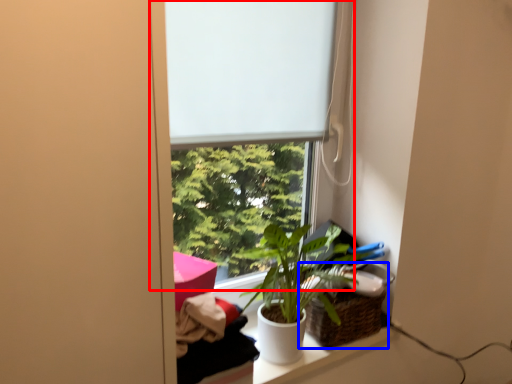
Question: Which object appears closest to the camera in this image, window (highlighted by a red box) or basket (highlighted by a blue box)?

Choices:
 (A) window
 (B) basket

Answer: (A)